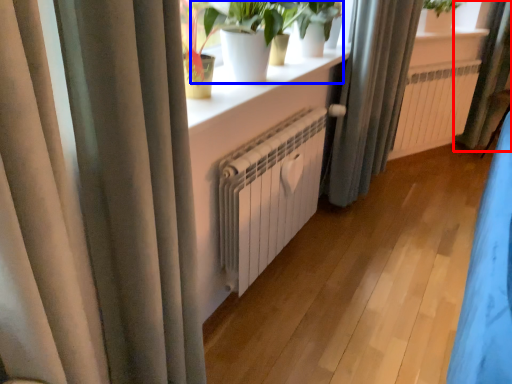
Question: Which object appears closest to the camera in this image, curtain (highlighted by a red box) or houseplant (highlighted by a blue box)?

Choices:
 (A) curtain
 (B) houseplant

Answer: (B)